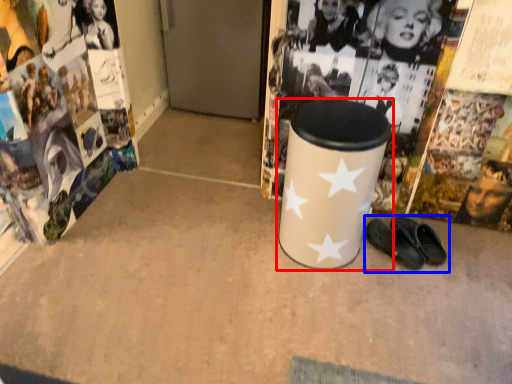
Question: Which point is further to the camera, waste container (highlighted by a red box) or footwear (highlighted by a blue box)?

Choices:
 (A) waste container
 (B) footwear

Answer: (B)